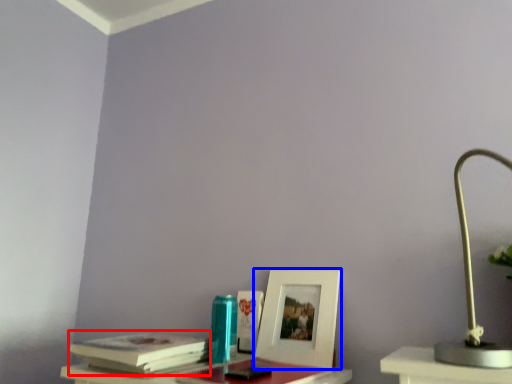
Question: Which point is closer to the camera, paperback book (highlighted by a red box) or picture frame (highlighted by a blue box)?

Choices:
 (A) paperback book
 (B) picture frame

Answer: (A)